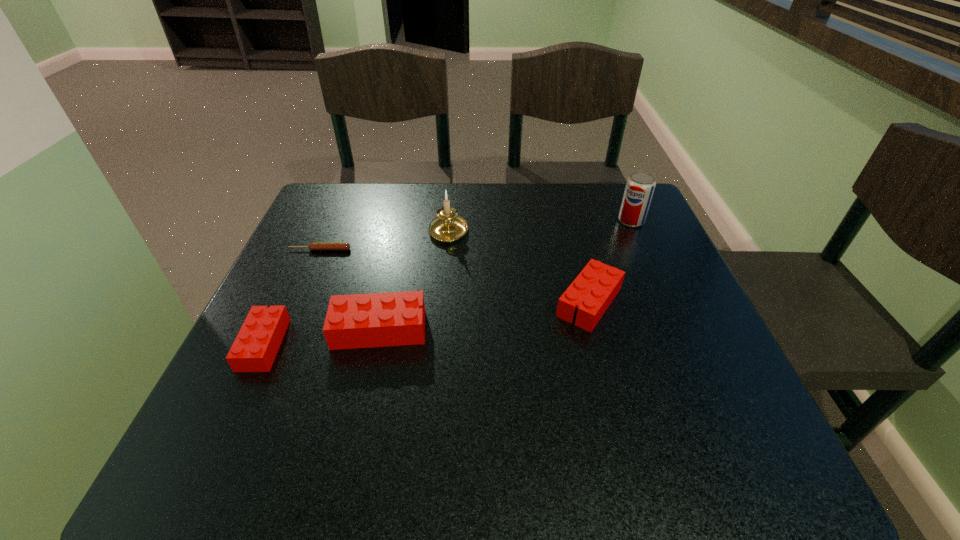
The width and height of the screenshot is (960, 540). What are the coordinates of `the fifth tallest object` in the screenshot? It's located at (254, 350).

The image size is (960, 540). In order to click on the leftmost Lego in this screenshot , I will do `click(254, 350)`.

Identify the location of the second Lego from right to left. This screenshot has width=960, height=540. (353, 321).

Find the location of a particular element. Image resolution: width=960 pixels, height=540 pixels. the fourth tallest object is located at coordinates (593, 290).

At what (x,y) coordinates should I click in order to perform the action: click on the second object from right to left. Please return your answer as a coordinate pair (x, y). This screenshot has width=960, height=540. Looking at the image, I should click on (593, 290).

The width and height of the screenshot is (960, 540). Find the location of `the rightmost object`. the rightmost object is located at coordinates [640, 185].

The height and width of the screenshot is (540, 960). What are the coordinates of `candle holder` in the screenshot? It's located at [448, 226].

The image size is (960, 540). I want to click on the shortest object, so click(336, 246).

Image resolution: width=960 pixels, height=540 pixels. In order to click on sausage in this screenshot , I will do `click(336, 246)`.

You are a GUI agent. You are given a task and a screenshot of the screen. Output one action in this format:
    pyautogui.click(x=<x>, y=<y>)
    Task: Click on the free space located 0.120m on the right of the fifth tallest object
    This screenshot has height=540, width=960.
    Given the screenshot: What is the action you would take?
    pyautogui.click(x=346, y=345)